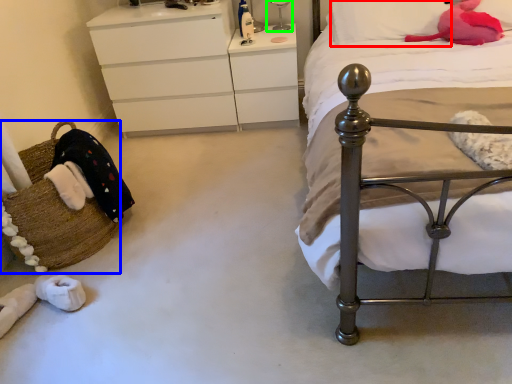
Question: Based on their relative distances, which object is nearer to pillow (highlighted by a red box)? Choose from basket (highlighted by a blue box) and bedside lamp (highlighted by a green box).

Choices:
 (A) basket
 (B) bedside lamp

Answer: (B)